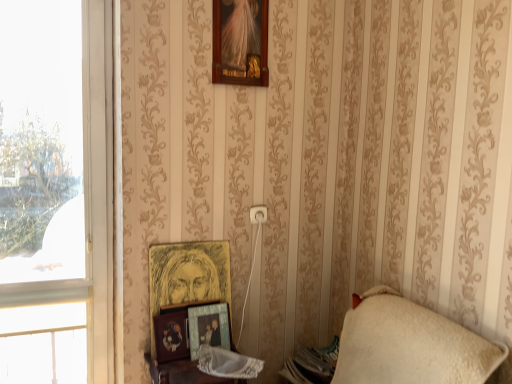
Question: Is metallic silver frame at lower center, the 4th picture frame positioned from the top, behind wooden table at lower center?

Choices:
 (A) no
 (B) yes

Answer: (B)

Question: From a real-world perspective, is metallic silver frame at lower center, the 4th picture frame positioned from the top, on top of wooden table at lower center?

Choices:
 (A) no
 (B) yes

Answer: (B)

Question: Does metallic silver frame at lower center, the 4th picture frame positioned from the top, have a lesser height compared to wooden table at lower center?

Choices:
 (A) no
 (B) yes

Answer: (B)

Question: From a real-world perspective, is metallic silver frame at lower center, positioned as the 1th picture frame in bottom-to-top order, below wooden table at lower center?

Choices:
 (A) no
 (B) yes

Answer: (A)

Question: From the image's perspective, is metallic silver frame at lower center, the 4th picture frame positioned from the top, on top of wooden table at lower center?

Choices:
 (A) no
 (B) yes

Answer: (B)

Question: Does point (199, 337) appear closer or farther from the camera than point (83, 175)?

Choices:
 (A) closer
 (B) farther

Answer: (A)

Question: In the image, is metallic silver frame at lower center, positioned as the 1th picture frame in bottom-to-top order, on the left side or the right side of transparent glass window at left, the 2th window in the bottom-to-top sequence?

Choices:
 (A) left
 (B) right

Answer: (B)

Question: Considering their positions, is metallic silver frame at lower center, the 4th picture frame positioned from the top, located in front of or behind transparent glass window at left, the 2th window in the bottom-to-top sequence?

Choices:
 (A) behind
 (B) front

Answer: (A)

Question: From a real-world perspective, is metallic silver frame at lower center, positioned as the 1th picture frame in bottom-to-top order, positioned above or below transparent glass window at left, the first window from the top?

Choices:
 (A) above
 (B) below

Answer: (B)

Question: Based on their sizes in the image, would you say wooden frame at upper center, the 4th picture frame when ordered from bottom to top, is bigger or smaller than wooden photo frame at lower center, which is the 2th picture frame from bottom to top?

Choices:
 (A) small
 (B) big

Answer: (B)

Question: Is wooden frame at upper center, the 4th picture frame when ordered from bottom to top, taller or shorter than wooden photo frame at lower center, which is the 2th picture frame from bottom to top?

Choices:
 (A) short
 (B) tall

Answer: (B)

Question: From a real-world perspective, is wooden frame at upper center, the 1th picture frame from the top, positioned above or below wooden photo frame at lower center, marked as the third picture frame in a top-to-bottom arrangement?

Choices:
 (A) below
 (B) above

Answer: (B)

Question: Would you say wooden frame at upper center, the 4th picture frame when ordered from bottom to top, is to the left or to the right of wooden photo frame at lower center, marked as the third picture frame in a top-to-bottom arrangement, in the picture?

Choices:
 (A) right
 (B) left

Answer: (A)

Question: Looking at their shapes, would you say metallic silver frame at lower center, the 4th picture frame positioned from the top, is wider or thinner than wooden photo frame at lower center, marked as the third picture frame in a top-to-bottom arrangement?

Choices:
 (A) wide
 (B) thin

Answer: (B)

Question: Is metallic silver frame at lower center, the 4th picture frame positioned from the top, taller or shorter than wooden photo frame at lower center, marked as the third picture frame in a top-to-bottom arrangement?

Choices:
 (A) tall
 (B) short

Answer: (A)